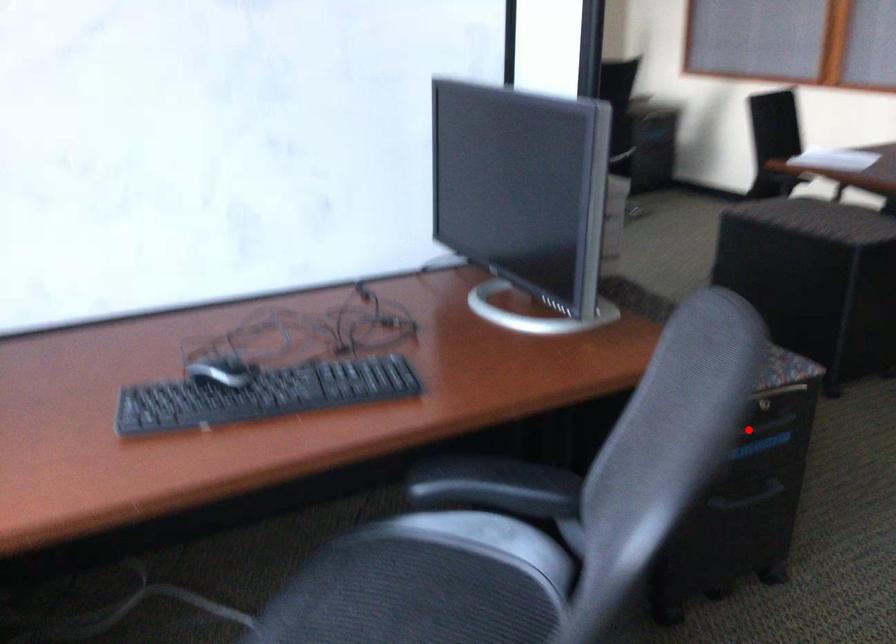
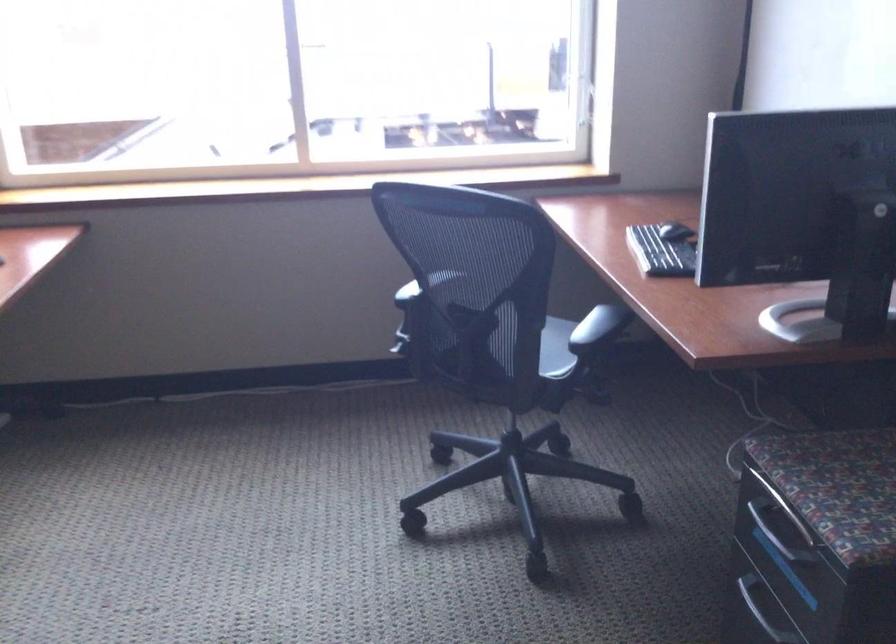
Where in the second image is the point corresponding to the highlighted location from the first image?

(776, 532)